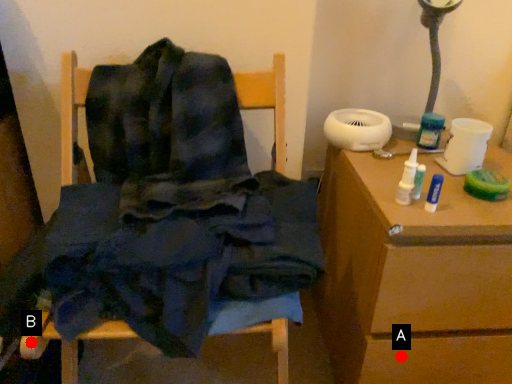
Question: Two points are circled on the image, labeled by A and B beside each circle. Which point is farther from the camera taking this photo?

Choices:
 (A) A is further
 (B) B is further

Answer: (A)